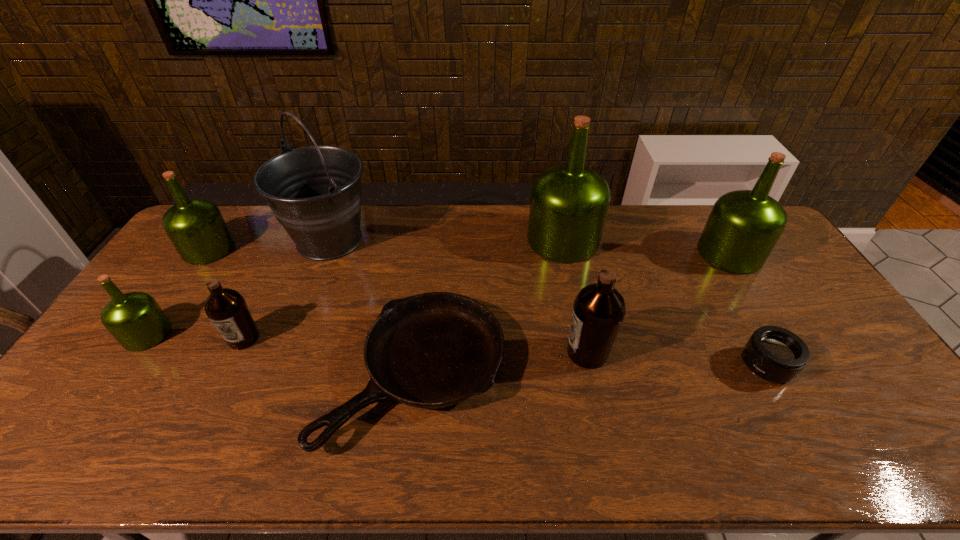
Find the location of a particular element. This screenshot has height=540, width=960. object positioned at the far right corner is located at coordinates (743, 227).

Find the location of a particular element. vacant space at the far edge of the desktop is located at coordinates (619, 212).

Image resolution: width=960 pixels, height=540 pixels. In order to click on free space at the near edge in this screenshot , I will do `click(206, 455)`.

This screenshot has height=540, width=960. What are the coordinates of `free space at the far left corner of the desktop` in the screenshot? It's located at (241, 205).

Image resolution: width=960 pixels, height=540 pixels. Identify the location of vacant region between the bucket and the nearest green olive oil. (238, 287).

I want to click on vacant area that lies between the left brown olive oil and the second tallest olive oil, so click(487, 296).

The height and width of the screenshot is (540, 960). I want to click on free space between the eighth tallest object and the third olive oil from left to right, so click(505, 352).

I want to click on free space between the telephoto lens and the seventh shortest object, so click(x=748, y=309).

You are a GUI agent. You are given a task and a screenshot of the screen. Output one action in this format:
    pyautogui.click(x=<x>, y=<y>)
    Task: Click on the unoccupied area between the fourth olive oil from right to left and the black frying pan
    This screenshot has height=540, width=960.
    Given the screenshot: What is the action you would take?
    pyautogui.click(x=330, y=356)

Find the location of a particular element. This screenshot has height=540, width=960. free area in between the rightmost green olive oil and the biggest green olive oil is located at coordinates (646, 247).